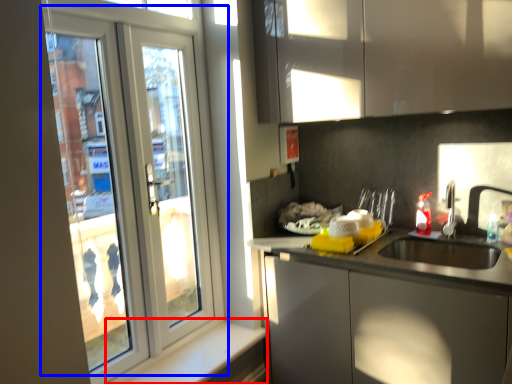
Question: Which of the following is the closest to the observer, window sill (highlighted by a red box) or door (highlighted by a blue box)?

Choices:
 (A) window sill
 (B) door

Answer: (B)